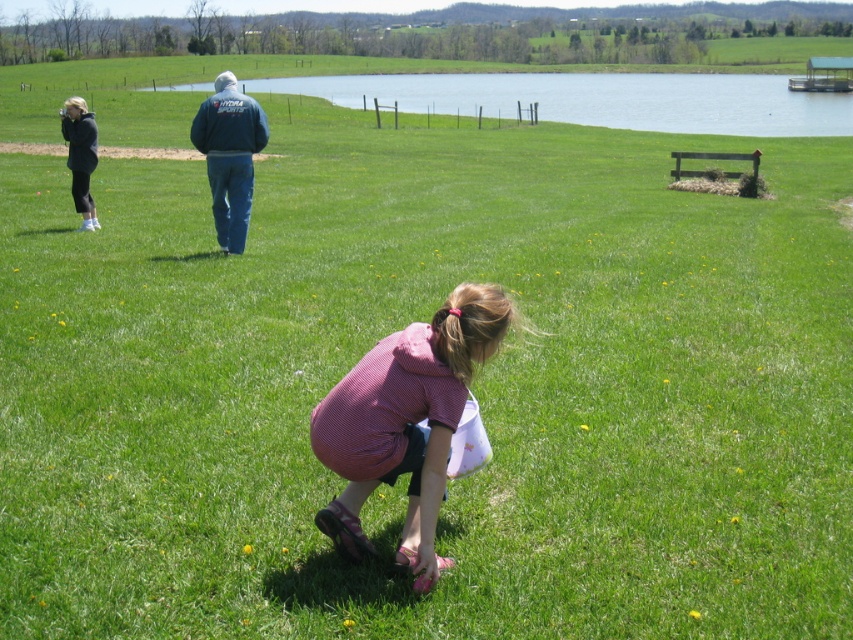
Which is behind, point (708, 118) or point (68, 112)?

The point (708, 118) is behind.

How distant is blue water at upper center from matte black jacket at left?

217.98 feet

Is point (596, 124) closer to viewer compared to point (71, 148)?

No, (596, 124) is behind (71, 148).

Locate an element on the screen. Image resolution: width=853 pixels, height=640 pixels. blue water at upper center is located at coordinates (595, 99).

Does blue water at upper center appear over denim jacket at upper center?

Yes, blue water at upper center is above denim jacket at upper center.

Does blue water at upper center appear on the right side of denim jacket at upper center?

Correct, you'll find blue water at upper center to the right of denim jacket at upper center.

This screenshot has width=853, height=640. What do you see at coordinates (595, 99) in the screenshot?
I see `blue water at upper center` at bounding box center [595, 99].

This screenshot has height=640, width=853. I want to click on blue water at upper center, so click(595, 99).

How far apart are pink fabric dress at center and blue water at upper center?

pink fabric dress at center and blue water at upper center are 199.93 feet apart from each other.

Which of these two, pink fabric dress at center or blue water at upper center, stands taller?

blue water at upper center is taller.

Is point (375, 365) behind point (444, 92)?

No, it is in front of (444, 92).

Locate an element on the screen. This screenshot has height=640, width=853. pink fabric dress at center is located at coordinates click(405, 420).